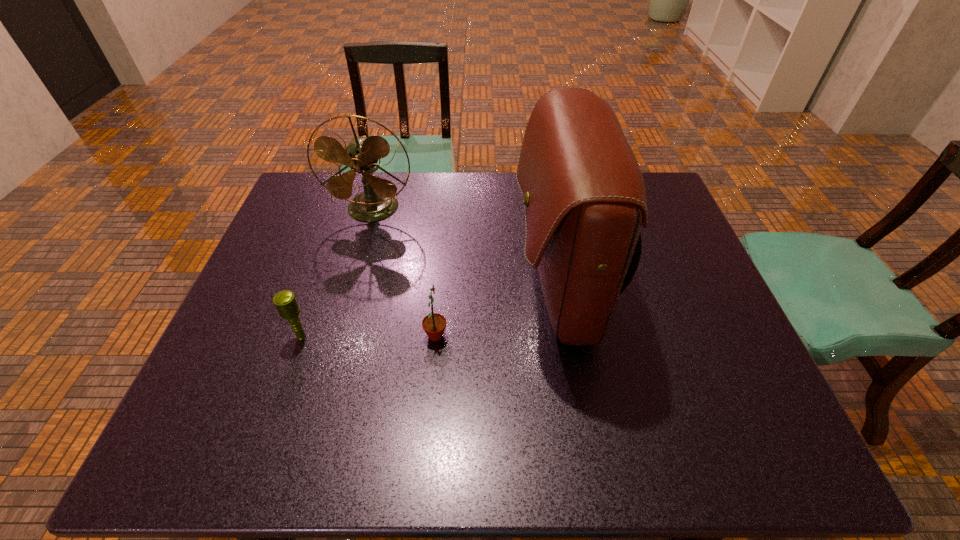
This screenshot has width=960, height=540. In the image, there is a desktop. Find the location of `vacant area at the right edge`. vacant area at the right edge is located at coordinates (666, 220).

Locate an element on the screen. This screenshot has width=960, height=540. vacant space at the far left corner of the desktop is located at coordinates (298, 214).

Find the location of a particular element. The image size is (960, 540). free spot between the farthest object and the sunflower is located at coordinates (404, 272).

You are a GUI agent. You are given a task and a screenshot of the screen. Output one action in this format:
    pyautogui.click(x=<x>, y=<y>)
    Task: Click on the vacant space that is in between the farthest object and the microphone
    Image resolution: width=960 pixels, height=540 pixels.
    Given the screenshot: What is the action you would take?
    pyautogui.click(x=338, y=273)

Image resolution: width=960 pixels, height=540 pixels. Find the location of `vacant area that lies between the farthest object and the second object from right to left`. vacant area that lies between the farthest object and the second object from right to left is located at coordinates (404, 272).

What are the coordinates of `empty location between the rightmost object and the fan` in the screenshot? It's located at (466, 248).

In order to click on free space between the third shortest object and the microphone in this screenshot , I will do `click(338, 273)`.

Where is `free space between the third object from left to right and the farthest object`? Image resolution: width=960 pixels, height=540 pixels. free space between the third object from left to right and the farthest object is located at coordinates (404, 272).

This screenshot has width=960, height=540. I want to click on unoccupied area between the microphone and the tallest object, so click(431, 312).

Locate an element on the screen. free space between the fan and the satchel is located at coordinates (466, 248).